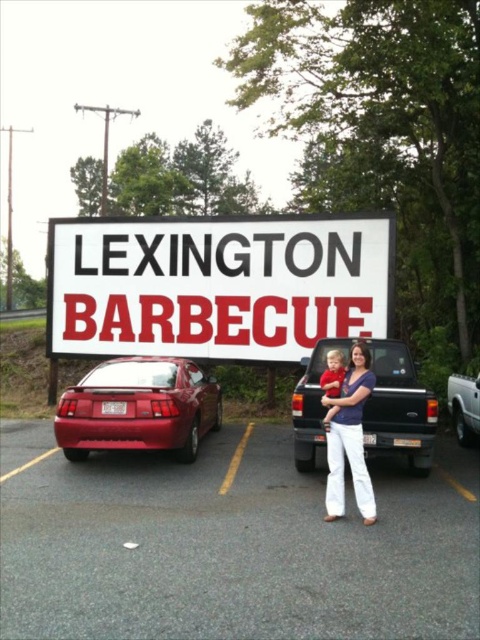
Question: Which point is farther to the camera?

Choices:
 (A) (298, 333)
 (B) (404, 605)

Answer: (A)

Question: Which point appears closest to the camera in this image?

Choices:
 (A) (458, 376)
 (B) (348, 461)
 (C) (215, 268)

Answer: (B)

Question: Among these objects, which one is farthest from the camera?

Choices:
 (A) white cotton pants at center
 (B) glossy red car at left

Answer: (B)

Question: Can you confirm if white cotton pants at center is bigger than red cotton shirt at center?

Choices:
 (A) yes
 (B) no

Answer: (A)

Question: Is white plastic sign at center wider than orange matte truck at center?

Choices:
 (A) no
 (B) yes

Answer: (B)

Question: Does gray asphalt parking lot at center have a greater width compared to orange matte truck at center?

Choices:
 (A) no
 (B) yes

Answer: (B)